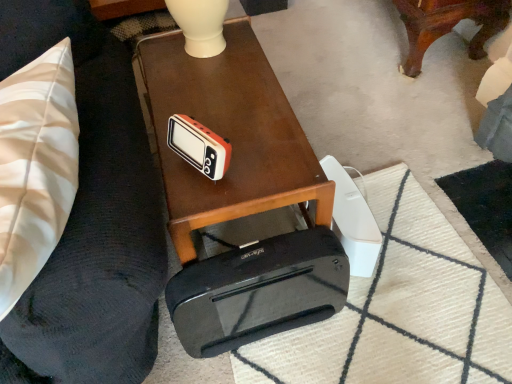
Question: Looking at the image, does orange matte clock at center seem bigger or smaller compared to wooden table at center?

Choices:
 (A) big
 (B) small

Answer: (B)

Question: From the image's perspective, is orange matte clock at center located above or below wooden table at center?

Choices:
 (A) above
 (B) below

Answer: (B)

Question: Considering the real-world distances, which object is closest to the black plastic cassette at lower center?

Choices:
 (A) black plastic printer at lower center
 (B) orange matte clock at center
 (C) black rubber mat at lower center
 (D) wooden table at center

Answer: (C)

Question: Estimate the real-world distances between objects in this image. Which object is closer to the black rubber mat at lower center?

Choices:
 (A) orange matte clock at center
 (B) black plastic printer at lower center
 (C) black plastic cassette at lower center
 (D) wooden table at center

Answer: (C)